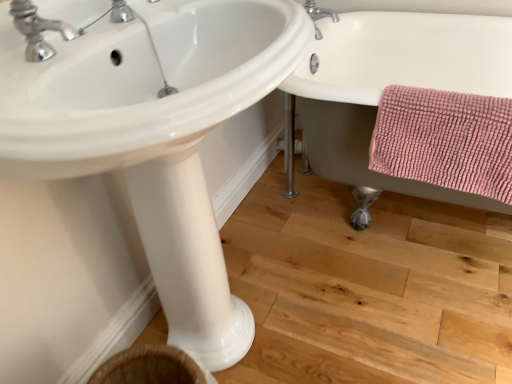
Question: Is white ceramic bathtub at right wider than white glossy pedestal at center?

Choices:
 (A) yes
 (B) no

Answer: (A)

Question: Is white glossy pedestal at center at the back of white ceramic bathtub at right?

Choices:
 (A) no
 (B) yes

Answer: (A)

Question: From the image's perspective, is white ceramic bathtub at right under white glossy pedestal at center?

Choices:
 (A) yes
 (B) no

Answer: (B)

Question: Does white ceramic bathtub at right lie behind white glossy pedestal at center?

Choices:
 (A) yes
 (B) no

Answer: (B)

Question: Can we say white ceramic bathtub at right lies outside white glossy pedestal at center?

Choices:
 (A) no
 (B) yes

Answer: (B)

Question: In the image, is pink chenille bath towel at lower right positioned in front of or behind white glossy pedestal at center?

Choices:
 (A) behind
 (B) front

Answer: (B)

Question: From the image's perspective, is pink chenille bath towel at lower right above or below white glossy pedestal at center?

Choices:
 (A) below
 (B) above

Answer: (B)

Question: Would you say pink chenille bath towel at lower right is inside or outside white glossy pedestal at center?

Choices:
 (A) outside
 (B) inside

Answer: (A)

Question: Does point (490, 110) appear closer or farther from the camera than point (175, 213)?

Choices:
 (A) closer
 (B) farther

Answer: (B)

Question: Does point (502, 134) appear closer or farther from the camera than point (253, 49)?

Choices:
 (A) closer
 (B) farther

Answer: (B)

Question: From the image's perspective, is pink chenille bath towel at lower right located above or below white glossy sink at center?

Choices:
 (A) above
 (B) below

Answer: (A)

Question: Looking at the image, does pink chenille bath towel at lower right seem bigger or smaller compared to white glossy sink at center?

Choices:
 (A) big
 (B) small

Answer: (B)

Question: From a real-world perspective, is pink chenille bath towel at lower right physically located above or below white glossy sink at center?

Choices:
 (A) below
 (B) above

Answer: (A)

Question: Based on their sizes in the image, would you say white ceramic bathtub at right is bigger or smaller than silver metallic faucet at upper center, which is counted as the second tap, starting from the left?

Choices:
 (A) big
 (B) small

Answer: (A)

Question: Choose the correct answer: Is white ceramic bathtub at right inside silver metallic faucet at upper center, the 2th tap positioned from the bottom, or outside it?

Choices:
 (A) inside
 (B) outside

Answer: (B)